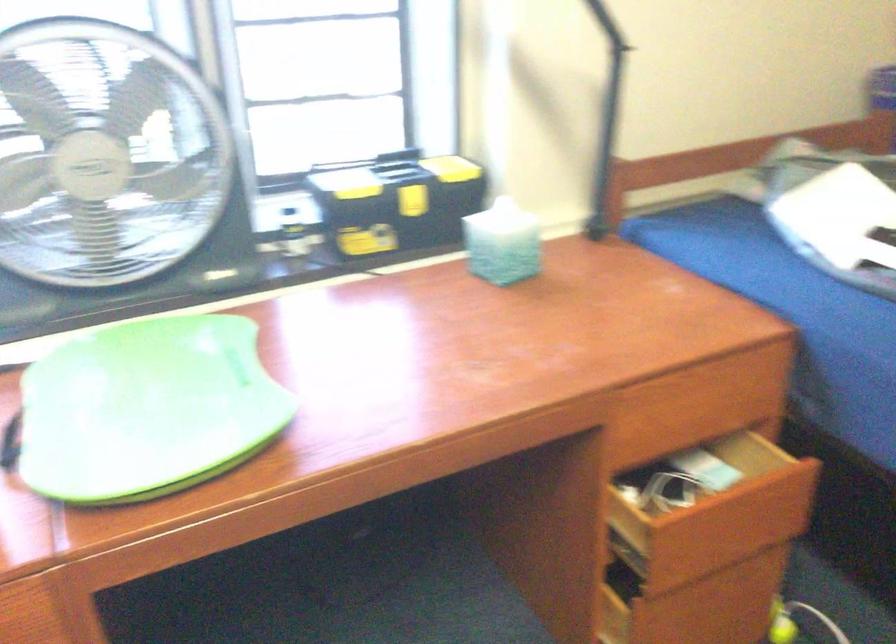
Find where to lift the black toolbox handle. Please return your answer as a coordinate pair (x, y).

(401, 185)